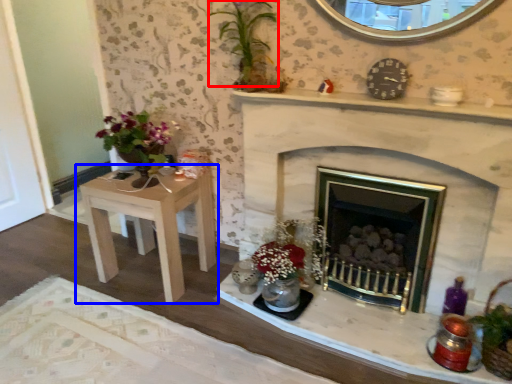
Question: Which object appears closest to the camera in this image, orchid (highlighted by a red box) or table (highlighted by a blue box)?

Choices:
 (A) orchid
 (B) table

Answer: (A)